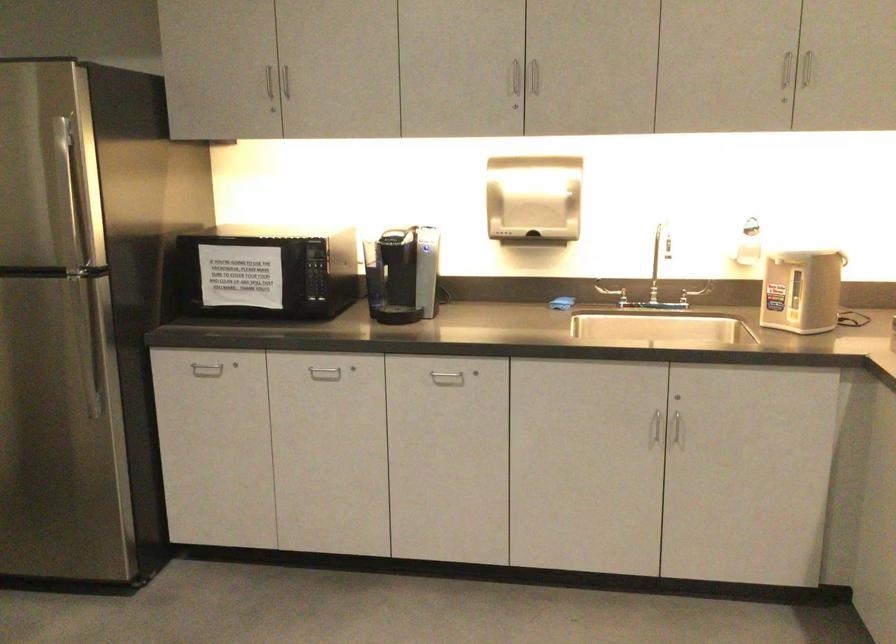
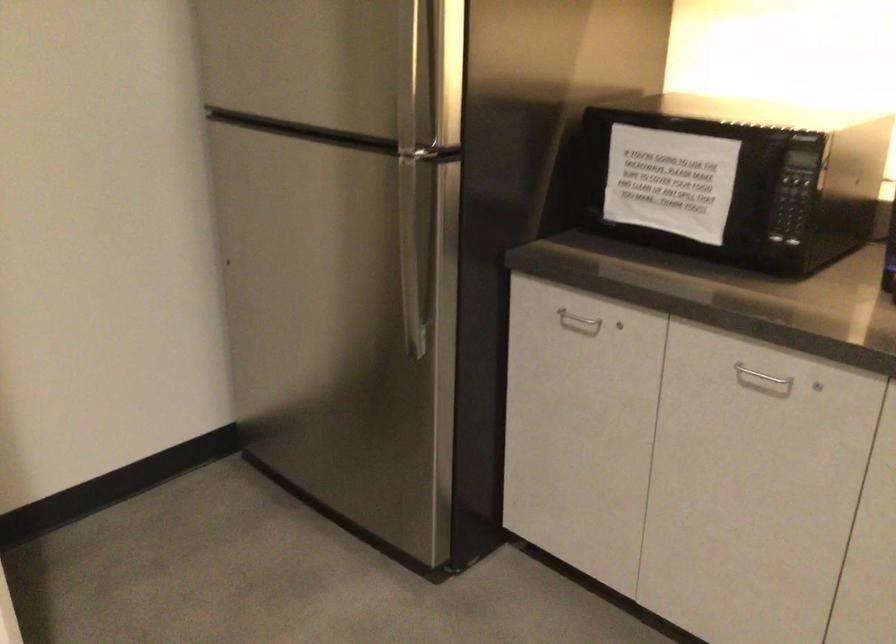
Question: How did the camera likely rotate?

Choices:
 (A) Left
 (B) Right
 (C) Up
 (D) Down

Answer: (A)